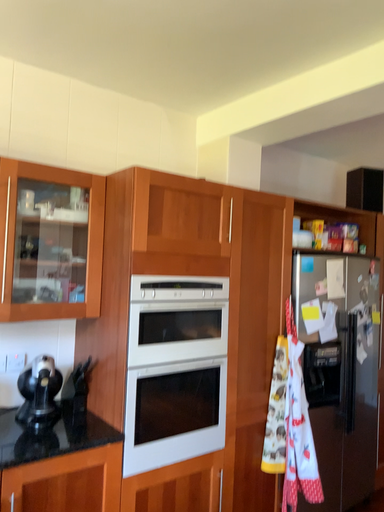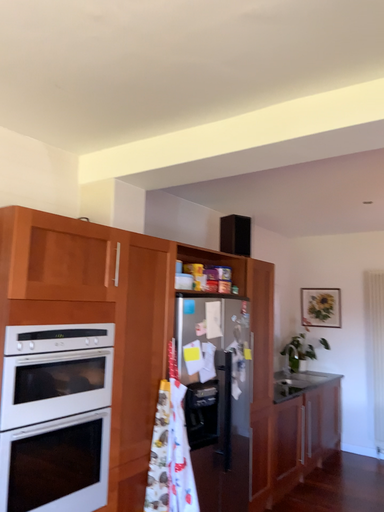
Question: Which way did the camera rotate in the video?

Choices:
 (A) rotated left
 (B) rotated right

Answer: (B)